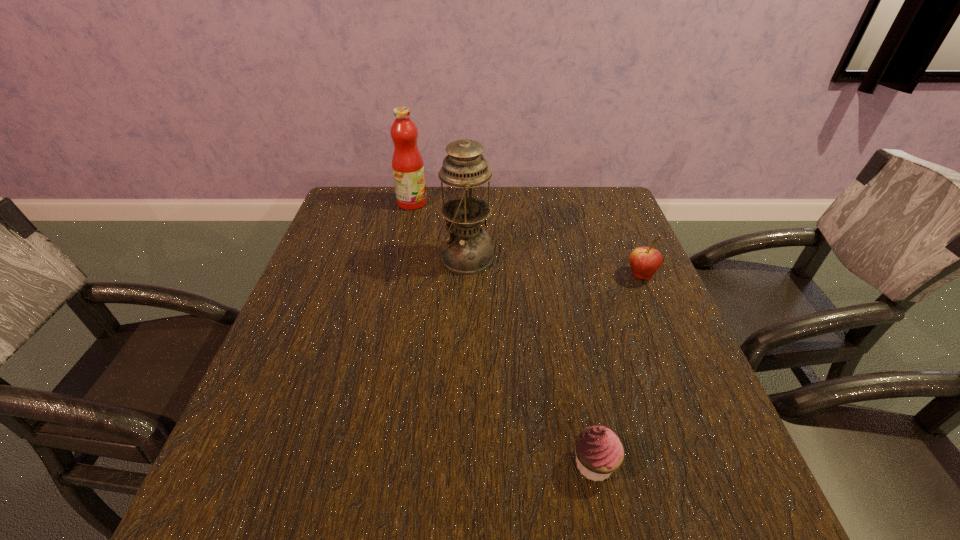
At what (x,y) coordinates should I click in order to perform the action: click on vacant area that lies between the apple and the second object from left to right. Please return your answer as a coordinate pair (x, y). Looking at the image, I should click on (553, 267).

Locate an element on the screen. The height and width of the screenshot is (540, 960). blank region between the oil lamp and the apple is located at coordinates (553, 267).

Find the location of `vacant space in between the oil lamp and the farthest object`. vacant space in between the oil lamp and the farthest object is located at coordinates pos(439,231).

In order to click on free area in between the rightmost object and the oil lamp in this screenshot , I will do `click(553, 267)`.

In order to click on vacant space in between the fruit juice and the oil lamp in this screenshot , I will do `click(439, 231)`.

This screenshot has width=960, height=540. I want to click on free space between the rightmost object and the farthest object, so click(527, 239).

The height and width of the screenshot is (540, 960). I want to click on free space that is in between the nearest object and the rightmost object, so click(x=617, y=370).

This screenshot has width=960, height=540. Find the location of `vacant point located between the rightmost object and the second object from right to left`. vacant point located between the rightmost object and the second object from right to left is located at coordinates (617, 370).

Find the location of a particular element. The width and height of the screenshot is (960, 540). vacant region between the rightmost object and the farthest object is located at coordinates (527, 239).

Locate an element on the screen. vacant area that lies between the nearest object and the rightmost object is located at coordinates (617, 370).